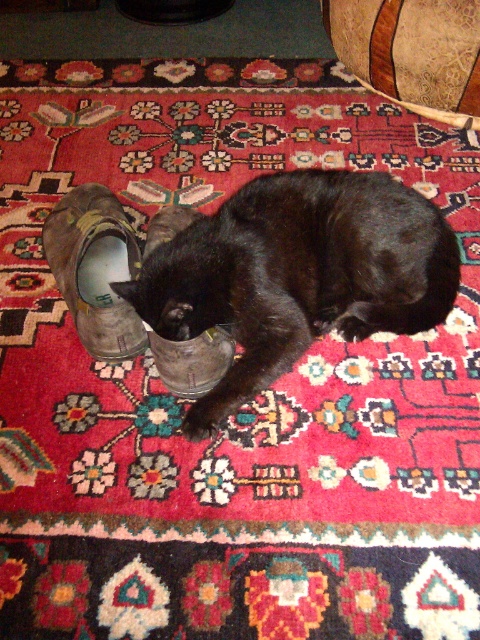
You are a photographer standing at the center of the room. You want to take a photo of the black matte fur cat at center. To do that, you need to adjust your camera to focus on the point at coordinate point (298, 275). Is this point located on the cat?

Yes, the point (298, 275) is on the black matte fur cat at center, so the camera should focus there to capture the cat clearly.